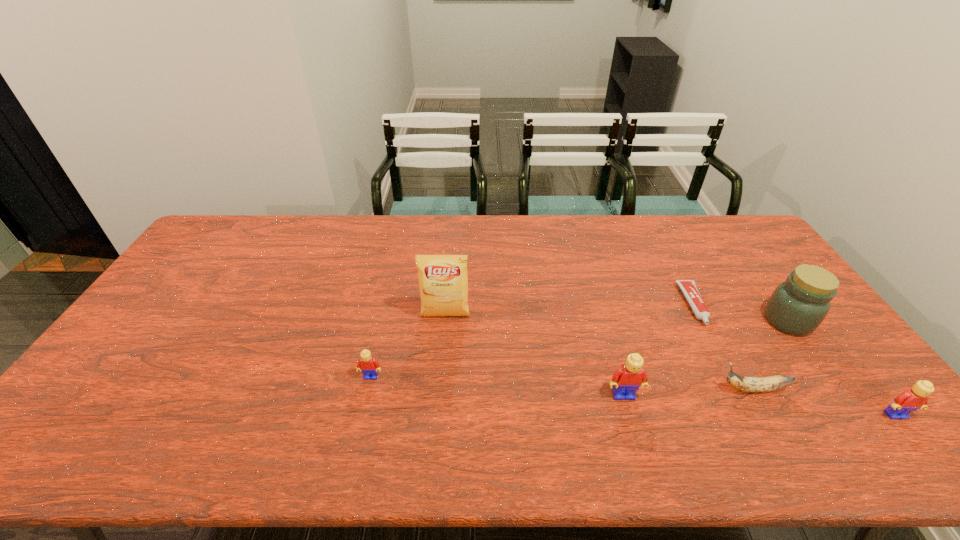
Where is `jar that is at the right edge`? jar that is at the right edge is located at coordinates (797, 307).

You are a GUI agent. You are given a task and a screenshot of the screen. Output one action in this format:
    pyautogui.click(x=<x>, y=<y>)
    Task: Click on the object present at the near right corner
    Image resolution: width=960 pixels, height=540 pixels.
    Given the screenshot: What is the action you would take?
    click(910, 400)

In the image, there is a desktop. At what (x,y) coordinates should I click in order to perform the action: click on vacant space at the far edge. Please return your answer as a coordinate pair (x, y). Looking at the image, I should click on (393, 234).

This screenshot has width=960, height=540. I want to click on free space at the near edge, so click(520, 400).

The height and width of the screenshot is (540, 960). I want to click on free region at the left edge, so click(x=176, y=296).

In order to click on free location at the far right corner in this screenshot , I will do `click(718, 227)`.

Where is `free space between the banana and the second tallest Lego`? This screenshot has width=960, height=540. free space between the banana and the second tallest Lego is located at coordinates (824, 402).

You are a GUI agent. You are given a task and a screenshot of the screen. Output one action in this format:
    pyautogui.click(x=<x>, y=<y>)
    Task: Click on the free spot between the shortest object and the jar
    This screenshot has width=960, height=540.
    Given the screenshot: What is the action you would take?
    pyautogui.click(x=741, y=313)

The width and height of the screenshot is (960, 540). I want to click on blank region between the shortest object and the fourth farthest object, so click(533, 341).

Where is `blank region between the banana and the nearest object`? The width and height of the screenshot is (960, 540). blank region between the banana and the nearest object is located at coordinates (824, 402).